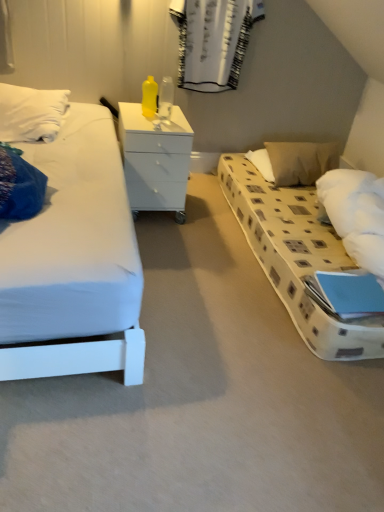
Question: Is white textured curtain at upper center bigger than beige fabric pillow at right?

Choices:
 (A) yes
 (B) no

Answer: (B)

Question: Is the depth of white textured curtain at upper center greater than that of beige fabric pillow at right?

Choices:
 (A) yes
 (B) no

Answer: (B)

Question: Is white textured curtain at upper center next to beige fabric pillow at right and touching it?

Choices:
 (A) no
 (B) yes

Answer: (A)

Question: From the image's perspective, is white textured curtain at upper center beneath beige fabric pillow at right?

Choices:
 (A) no
 (B) yes

Answer: (A)

Question: Does white textured curtain at upper center turn towards beige fabric pillow at right?

Choices:
 (A) yes
 (B) no

Answer: (B)

Question: Is beige fabric pillow at right inside white textured curtain at upper center?

Choices:
 (A) no
 (B) yes

Answer: (A)

Question: From the image's perspective, does white textured curtain at upper center appear higher than white glossy chest of drawers at center?

Choices:
 (A) yes
 (B) no

Answer: (A)

Question: From the image's perspective, is white textured curtain at upper center located beneath white glossy chest of drawers at center?

Choices:
 (A) yes
 (B) no

Answer: (B)

Question: Is white textured curtain at upper center touching white glossy chest of drawers at center?

Choices:
 (A) no
 (B) yes

Answer: (A)

Question: From a real-world perspective, does white textured curtain at upper center stand above white glossy chest of drawers at center?

Choices:
 (A) yes
 (B) no

Answer: (A)

Question: Is white textured curtain at upper center further to the viewer compared to white glossy chest of drawers at center?

Choices:
 (A) no
 (B) yes

Answer: (B)

Question: Is white textured curtain at upper center positioned before white glossy chest of drawers at center?

Choices:
 (A) yes
 (B) no

Answer: (B)

Question: Is beige fabric pillow at right oriented towards white glossy chest of drawers at center?

Choices:
 (A) yes
 (B) no

Answer: (B)